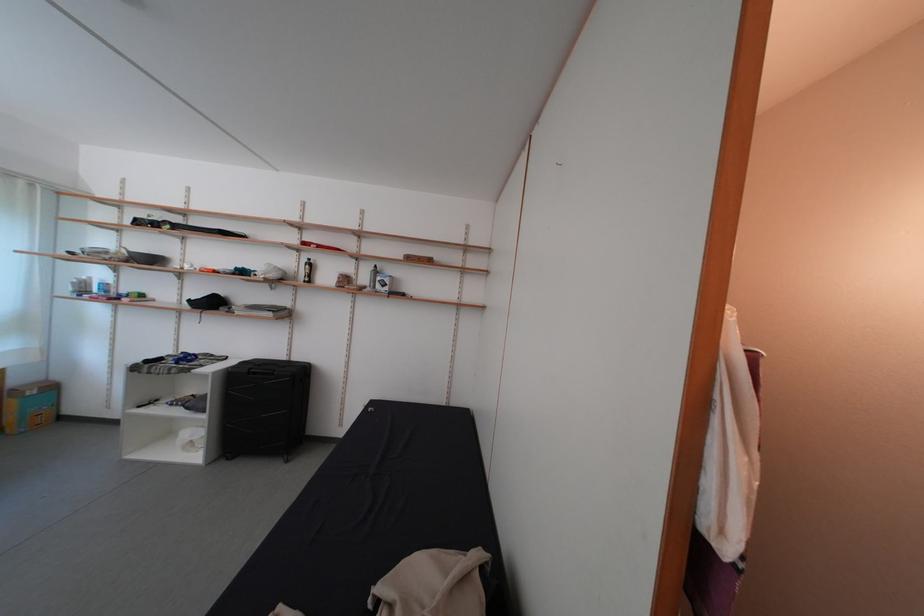
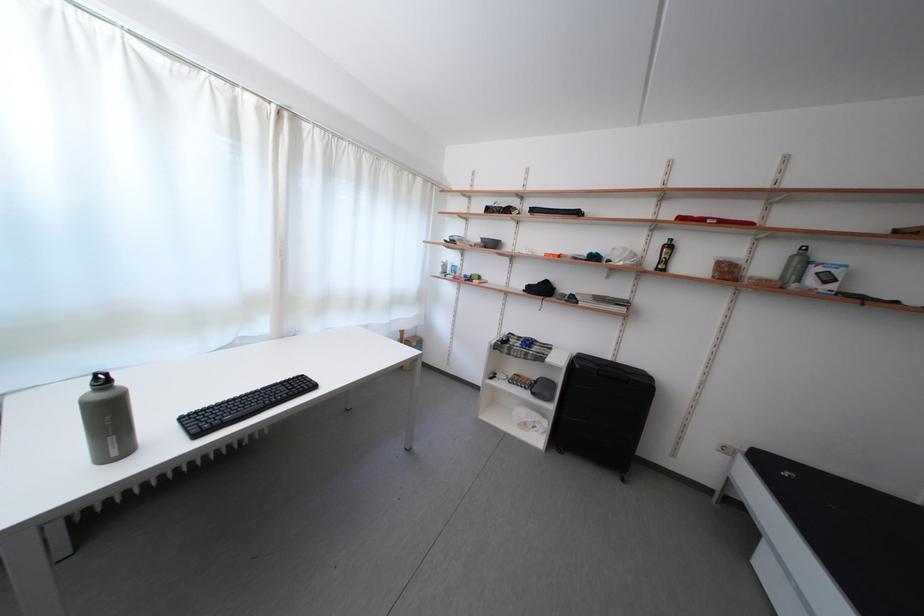
Where in the second image is the point corresponding to point 313,265 from the first image?

(669, 246)